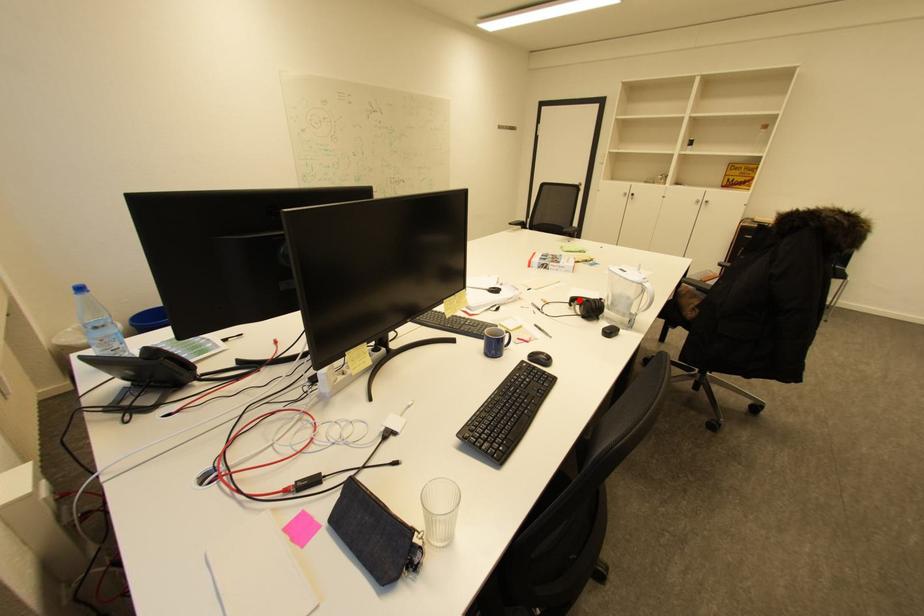
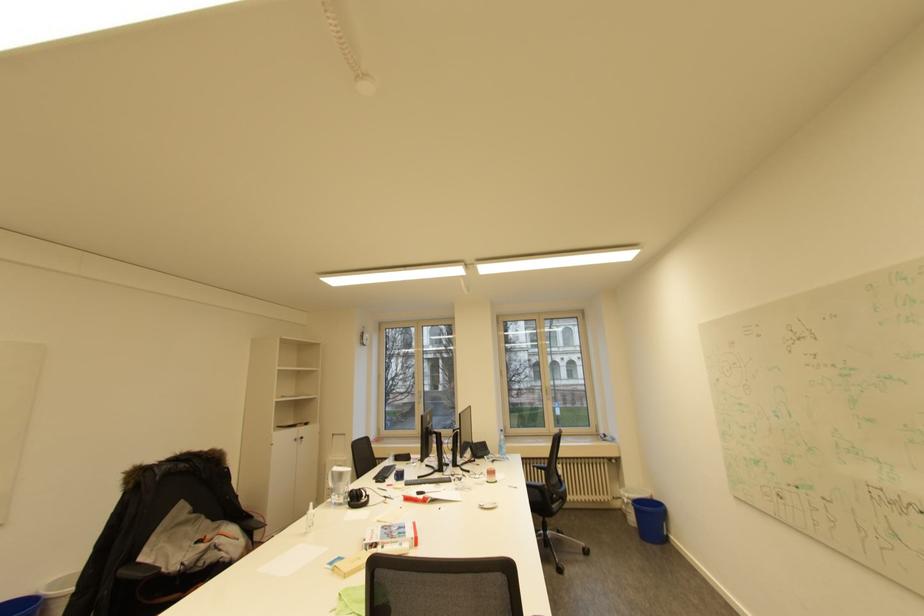
Question: I am providing you with two images of the same scene from different viewpoints. A red point is marked on the first image. Can you still see the location of the red point in image 2?

Choices:
 (A) Yes
 (B) No

Answer: (B)